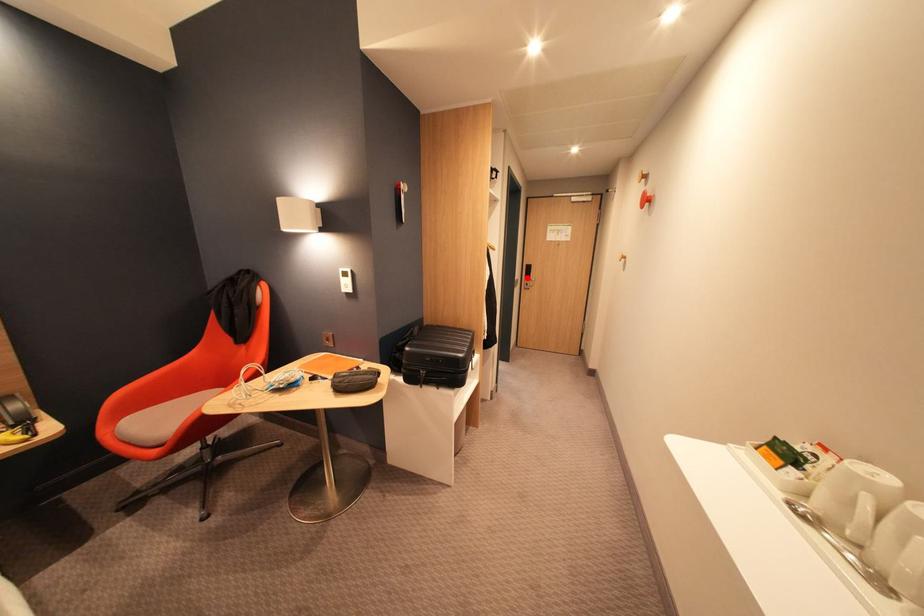
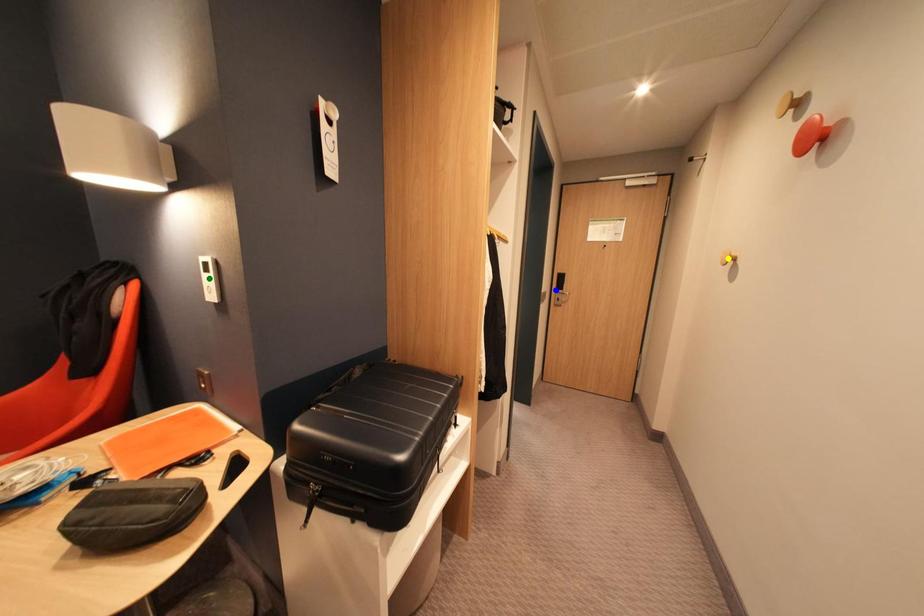
Question: I am providing you with two images of the same scene from different viewpoints. A red point is marked on the first image. You are given multiple points on the second image. Which point in image 2 represents the same 3d spot as the red point in image 1?

Choices:
 (A) green point
 (B) yellow point
 (C) blue point

Answer: (C)